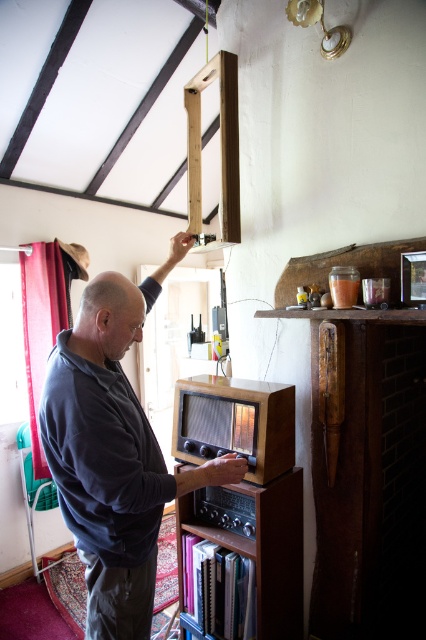
Is dark blue sweater at lower left positioned behind wooden bookshelf at center?

No, dark blue sweater at lower left is in front of wooden bookshelf at center.

Who is higher up, dark blue sweater at lower left or wooden bookshelf at center?

Positioned higher is dark blue sweater at lower left.

You are a GUI agent. You are given a task and a screenshot of the screen. Output one action in this format:
    pyautogui.click(x=<x>, y=<y>)
    Task: Click on the dark blue sweater at lower left
    This screenshot has width=426, height=640.
    Given the screenshot: What is the action you would take?
    pyautogui.click(x=114, y=451)

Locate an element on the screen. This screenshot has width=426, height=640. dark blue sweater at lower left is located at coordinates (114, 451).